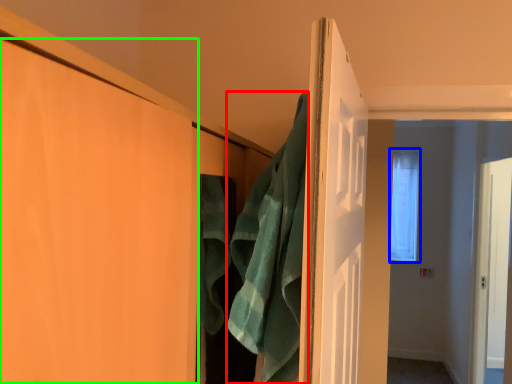
Question: Which is farther away from bath towel (highlighted by a red box)? window (highlighted by a blue box) or door (highlighted by a green box)?

Choices:
 (A) window
 (B) door

Answer: (A)